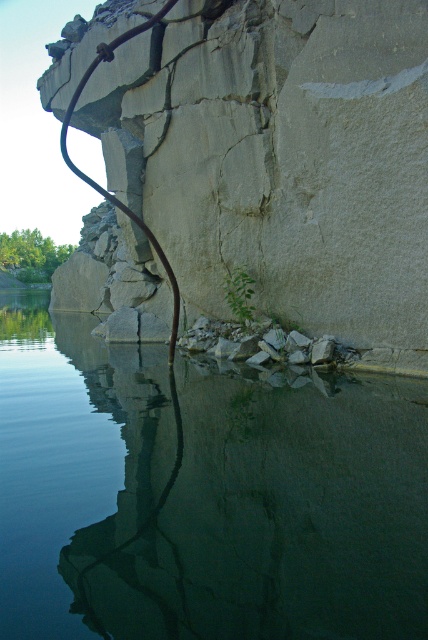
Question: Which point is closer to the camera?

Choices:
 (A) (282, 92)
 (B) (35, 310)

Answer: (A)

Question: Does clear water at center have a smaller size compared to smooth concrete cliff at center?

Choices:
 (A) no
 (B) yes

Answer: (B)

Question: Which point is farther to the camera?

Choices:
 (A) (163, 621)
 (B) (160, 108)

Answer: (B)

Question: Is clear water at center below smooth concrete cliff at center?

Choices:
 (A) yes
 (B) no

Answer: (A)

Question: Can you confirm if clear water at center is positioned to the right of smooth concrete cliff at center?

Choices:
 (A) no
 (B) yes

Answer: (B)